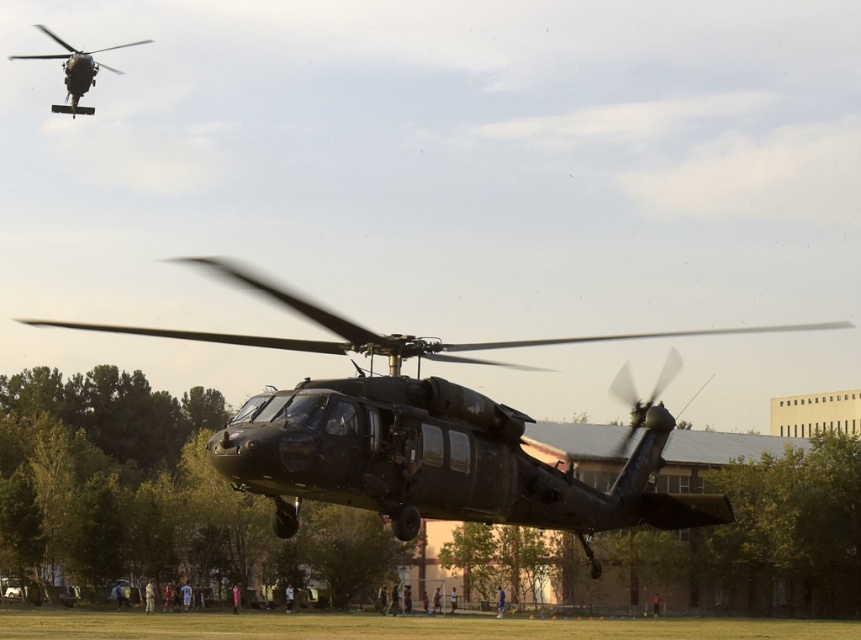
Question: Is matte black helicopter at center smaller than matte black helicopter at upper left?

Choices:
 (A) yes
 (B) no

Answer: (B)

Question: Does matte black helicopter at center appear on the left side of matte black helicopter at upper left?

Choices:
 (A) yes
 (B) no

Answer: (B)

Question: Which point is closer to the camera?

Choices:
 (A) matte black helicopter at center
 (B) matte black helicopter at upper left

Answer: (A)

Question: Does matte black helicopter at center lie in front of matte black helicopter at upper left?

Choices:
 (A) yes
 (B) no

Answer: (A)